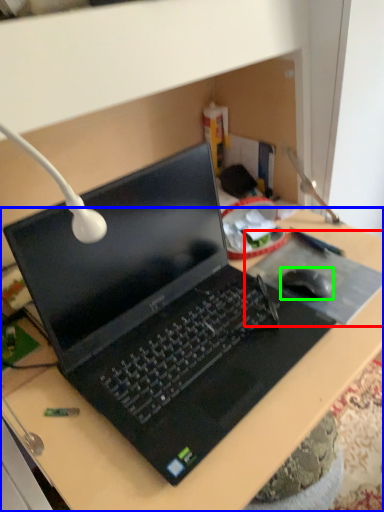
Question: Which is nearer to the mousepad (highlighted by a red box)? desk (highlighted by a blue box) or mouse (highlighted by a green box).

Choices:
 (A) desk
 (B) mouse

Answer: (B)